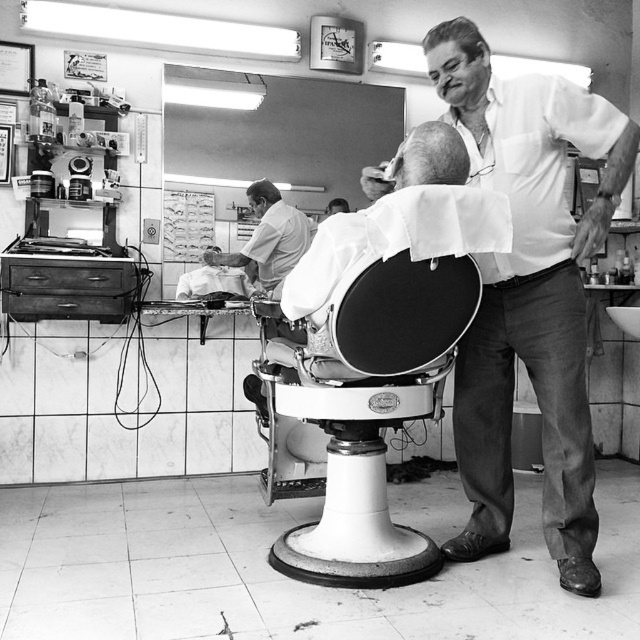
You are a customer in the barbershop and want to know if you can comfortably sit between the white cotton shirt at upper right and the gray matte hair at upper center without touching either. The average shoulder width of a person is 18 inches. Can you fit?

The distance between the white cotton shirt at upper right and the gray matte hair at upper center is 24.89 inches. Since the average shoulder width is 18 inches, there is enough space to sit comfortably between them without touching either.

You are a customer in the barbershop and want to know the position of the white cotton shirt at upper right and the gray matte hair at upper center. Which one is located to the right side of the other?

The white cotton shirt at upper right is to the right of gray matte hair at upper center according to the description.

You are a customer in the barbershop and want to know where the white cotton shirt at upper right is located. Please provide its coordinates in the image.

The white cotton shirt at upper right is located at coordinates point (531, 301).